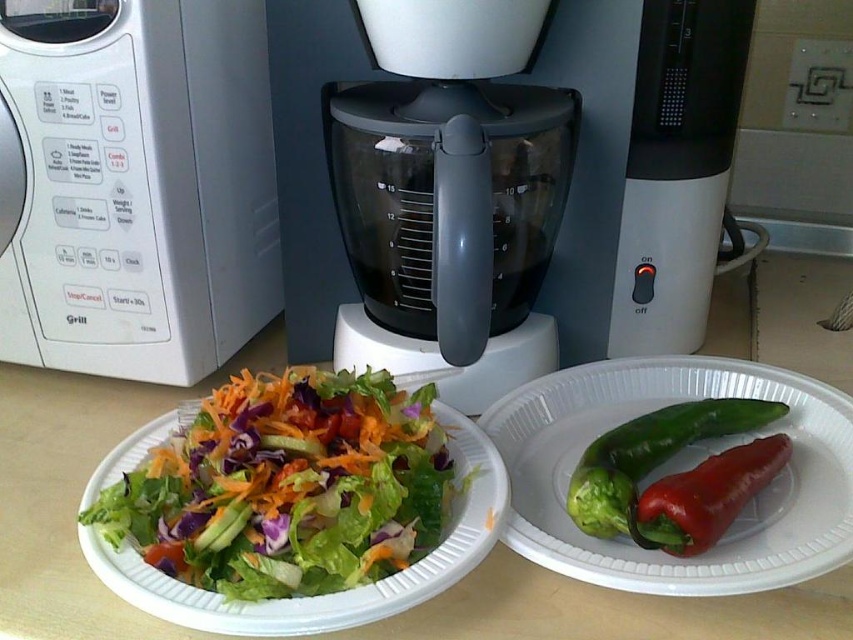
Question: Among these objects, which one is nearest to the camera?

Choices:
 (A) fresh green salad at center
 (B) green matte paper plate at right
 (C) transparent plastic food processor at center
 (D) white plastic microwave at left

Answer: (A)

Question: Considering the relative positions of white plastic microwave at left and green matte paper plate at right in the image provided, where is white plastic microwave at left located with respect to green matte paper plate at right?

Choices:
 (A) right
 (B) left

Answer: (B)

Question: Is the position of transparent plastic food processor at center more distant than that of green matte pepper at center?

Choices:
 (A) yes
 (B) no

Answer: (A)

Question: From the image, what is the correct spatial relationship of white plastic microwave at left in relation to green matte pepper at center?

Choices:
 (A) right
 (B) left

Answer: (B)

Question: Which point is closer to the camera?

Choices:
 (A) (688, 544)
 (B) (635, 588)
 (C) (30, 124)
 (D) (303, 545)

Answer: (B)

Question: Considering the real-world distances, which object is farthest from the white plastic microwave at left?

Choices:
 (A) fresh green salad at center
 (B) transparent plastic food processor at center

Answer: (A)